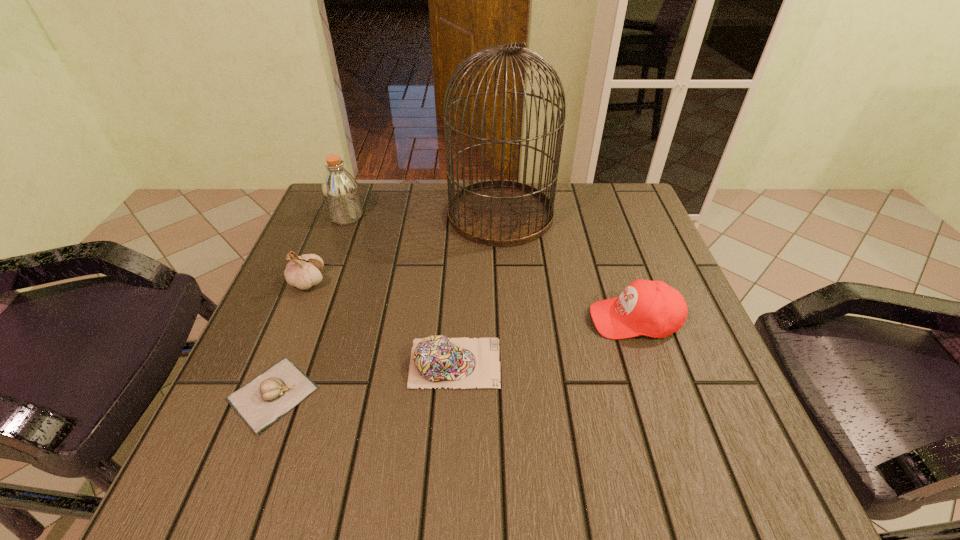
Locate an element on the screen. vacant space located on the back of the second tallest object is located at coordinates (357, 188).

Find the location of a particular element. The height and width of the screenshot is (540, 960). vacant space situated on the front of the fourth nearest object is located at coordinates (228, 475).

This screenshot has height=540, width=960. Find the location of `free space located on the front panel of the third shortest object`. free space located on the front panel of the third shortest object is located at coordinates (486, 320).

At what (x,y) coordinates should I click in order to perform the action: click on vacant space situated 0.190m on the front panel of the third shortest object. Please return your answer as a coordinate pair (x, y). The width and height of the screenshot is (960, 540). Looking at the image, I should click on (495, 320).

At what (x,y) coordinates should I click in order to perform the action: click on vacant space located 0.350m on the front panel of the third shortest object. Please return your answer as a coordinate pair (x, y). This screenshot has height=540, width=960. Looking at the image, I should click on (417, 320).

Where is `free space located 0.160m on the front, side, and top of the cap`? This screenshot has height=540, width=960. free space located 0.160m on the front, side, and top of the cap is located at coordinates 587,363.

Where is `vacant point located on the back of the shorter garlic`? vacant point located on the back of the shorter garlic is located at coordinates (337, 231).

You are a GUI agent. You are given a task and a screenshot of the screen. Output one action in this format:
    pyautogui.click(x=<x>, y=<y>)
    Task: Click on the birdcage located at the far edge
    The width and height of the screenshot is (960, 540).
    Given the screenshot: What is the action you would take?
    pyautogui.click(x=501, y=213)

Where is `bottle that is at the far edge`? Image resolution: width=960 pixels, height=540 pixels. bottle that is at the far edge is located at coordinates (340, 190).

Locate an element on the screen. This screenshot has height=540, width=960. object that is at the near edge is located at coordinates (261, 402).